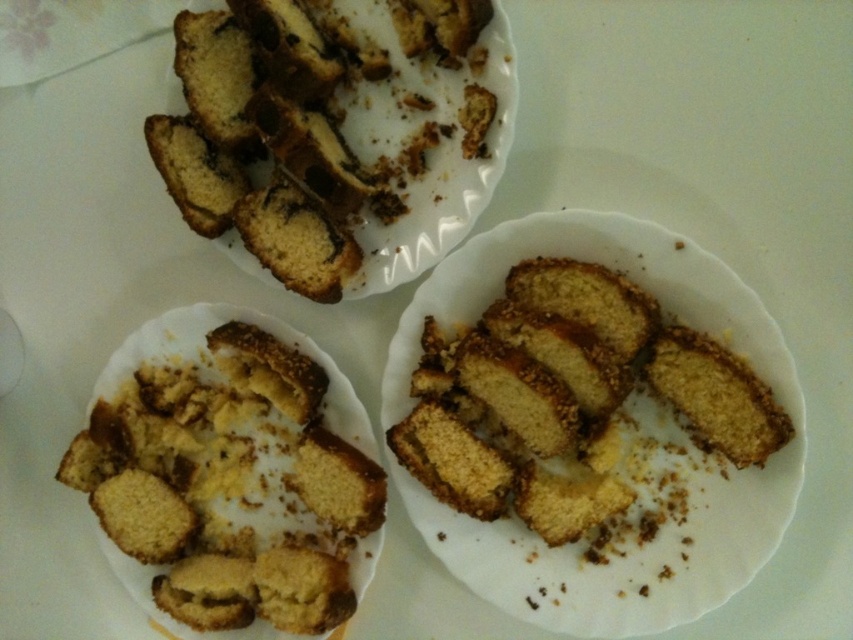
Does golden crumbly muffin at lower left have a greater height compared to golden crumbly cake at center?

Yes.

Between point (181, 458) and point (665, 333), which one is positioned in front?

Point (665, 333) is more forward.

Is point (196, 548) positioned behind point (766, 424)?

Yes, it is behind point (766, 424).

What are the coordinates of `golden crumbly muffin at lower left` in the screenshot? It's located at (231, 476).

Which is behind, point (424, 294) or point (711, 413)?

Point (424, 294)

Is white matte plate at center taller than golden crumbly cake at center?

Indeed, white matte plate at center has a greater height compared to golden crumbly cake at center.

Is point (405, 365) closer to camera compared to point (703, 346)?

No.

I want to click on white matte plate at center, so pyautogui.click(x=637, y=433).

How distant is golden crumbly muffin at lower left from white matte plate at center?

golden crumbly muffin at lower left and white matte plate at center are 25.60 centimeters apart from each other.

The image size is (853, 640). In order to click on golden crumbly muffin at lower left in this screenshot , I will do `click(231, 476)`.